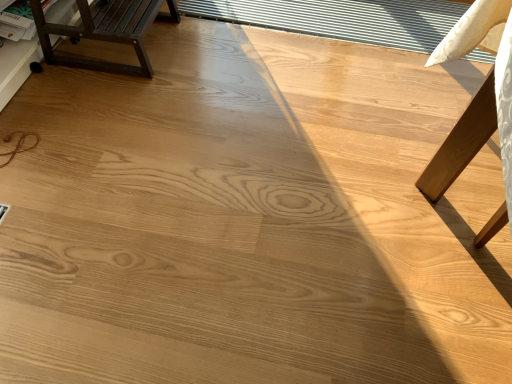
Where is `free area below matte dark brown wooden bench at upper left (from a real-world perspective)`? The width and height of the screenshot is (512, 384). free area below matte dark brown wooden bench at upper left (from a real-world perspective) is located at coordinates click(x=119, y=47).